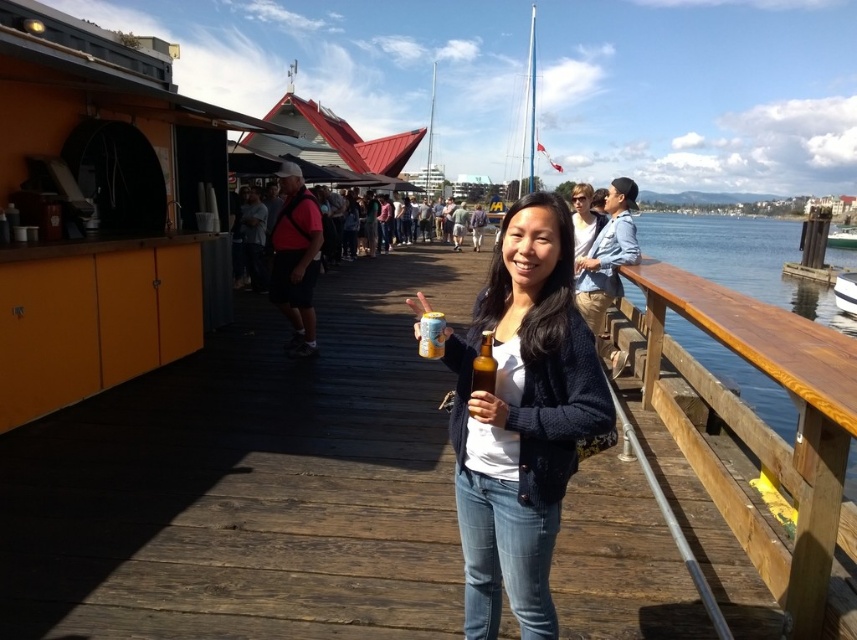
Looking at this image, is wooden rail at right bigger than yellow matte can at center?

Yes, wooden rail at right is bigger than yellow matte can at center.

Is wooden rail at right wider than yellow matte can at center?

Yes, wooden rail at right is wider than yellow matte can at center.

At what (x,y) coordinates should I click in order to perform the action: click on wooden rail at right. Please return your answer as a coordinate pair (x, y). Looking at the image, I should click on (764, 433).

Locate an element on the screen. The height and width of the screenshot is (640, 857). wooden rail at right is located at coordinates (764, 433).

Is wooden deck at center further to camera compared to yellow matte can at center?

That is True.

Between point (346, 627) and point (436, 310), which one is positioned in front?

Positioned in front is point (346, 627).

Image resolution: width=857 pixels, height=640 pixels. Identify the location of wooden deck at center. (250, 483).

Can you confirm if wooden deck at center is bigger than knit sweater at center?

Correct, wooden deck at center is larger in size than knit sweater at center.

Which is below, wooden deck at center or knit sweater at center?

knit sweater at center

Between point (560, 548) and point (453, 449), which one is positioned in front?

Point (453, 449) is more forward.

You are a GUI agent. You are given a task and a screenshot of the screen. Output one action in this format:
    pyautogui.click(x=<x>, y=<y>)
    Task: Click on the wooden deck at center
    
    Given the screenshot: What is the action you would take?
    pyautogui.click(x=250, y=483)